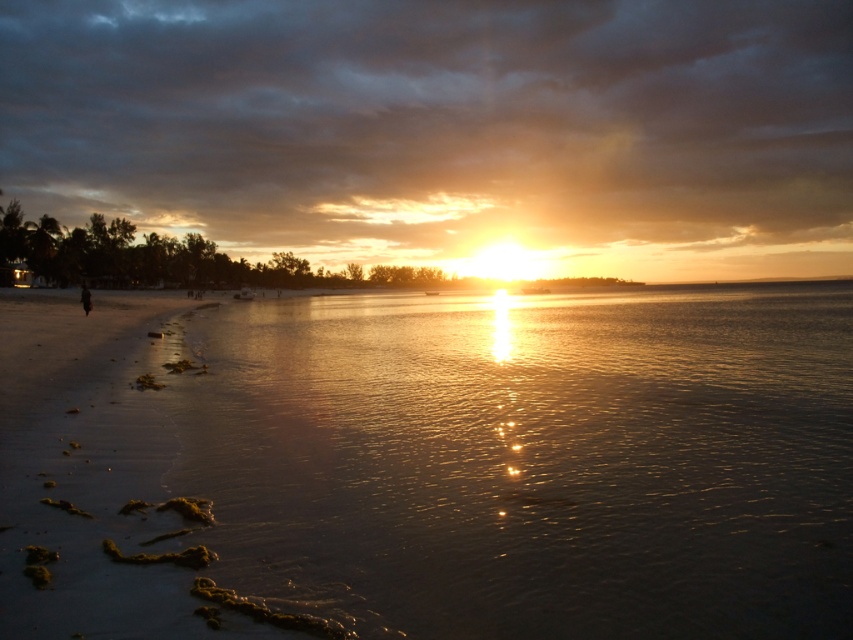
Question: Which point is closer to the camera?

Choices:
 (A) dark hair at left
 (B) glistening water at center

Answer: (B)

Question: Which of the following is the farthest from the observer?

Choices:
 (A) (80, 289)
 (B) (378, 394)

Answer: (A)

Question: Does glistening water at center have a smaller size compared to dark hair at left?

Choices:
 (A) yes
 (B) no

Answer: (B)

Question: Is glistening water at center to the left of dark hair at left from the viewer's perspective?

Choices:
 (A) no
 (B) yes

Answer: (A)

Question: Does glistening water at center have a smaller size compared to dark hair at left?

Choices:
 (A) yes
 (B) no

Answer: (B)

Question: Which object appears closest to the camera in this image?

Choices:
 (A) glistening water at center
 (B) dark hair at left

Answer: (A)